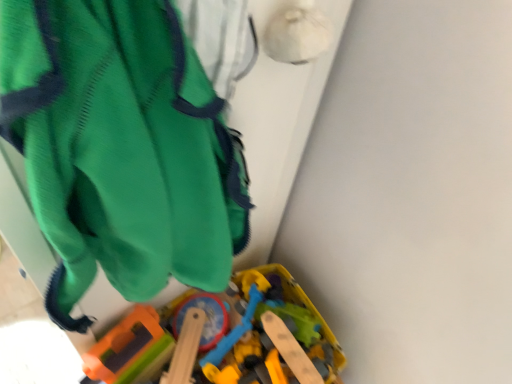
Question: Is green fabric backpack at upper left completely or partially outside of wooden toy train at lower center?

Choices:
 (A) yes
 (B) no

Answer: (A)

Question: Are green fabric backpack at upper left and wooden toy train at lower center beside each other?

Choices:
 (A) yes
 (B) no

Answer: (B)

Question: From the image's perspective, is green fabric backpack at upper left beneath wooden toy train at lower center?

Choices:
 (A) yes
 (B) no

Answer: (B)

Question: Is wooden toy train at lower center at the back of green fabric backpack at upper left?

Choices:
 (A) no
 (B) yes

Answer: (A)

Question: Is green fabric backpack at upper left thinner than wooden toy train at lower center?

Choices:
 (A) no
 (B) yes

Answer: (B)

Question: Considering the relative positions of green fabric backpack at upper left and wooden toy train at lower center in the image provided, is green fabric backpack at upper left to the right of wooden toy train at lower center from the viewer's perspective?

Choices:
 (A) no
 (B) yes

Answer: (A)

Question: From the image's perspective, is wooden toy train at lower center on top of green fabric backpack at upper left?

Choices:
 (A) yes
 (B) no

Answer: (B)

Question: Does wooden toy train at lower center have a larger size compared to green fabric backpack at upper left?

Choices:
 (A) no
 (B) yes

Answer: (B)

Question: Can we say wooden toy train at lower center lies outside green fabric backpack at upper left?

Choices:
 (A) no
 (B) yes

Answer: (B)

Question: Does wooden toy train at lower center appear on the right side of green fabric backpack at upper left?

Choices:
 (A) yes
 (B) no

Answer: (A)

Question: From a real-world perspective, is wooden toy train at lower center positioned over green fabric backpack at upper left based on gravity?

Choices:
 (A) yes
 (B) no

Answer: (B)

Question: Is wooden toy train at lower center shorter than green fabric backpack at upper left?

Choices:
 (A) yes
 (B) no

Answer: (A)

Question: Would you say green fabric backpack at upper left is to the left or to the right of wooden toy train at lower center in the picture?

Choices:
 (A) left
 (B) right

Answer: (A)